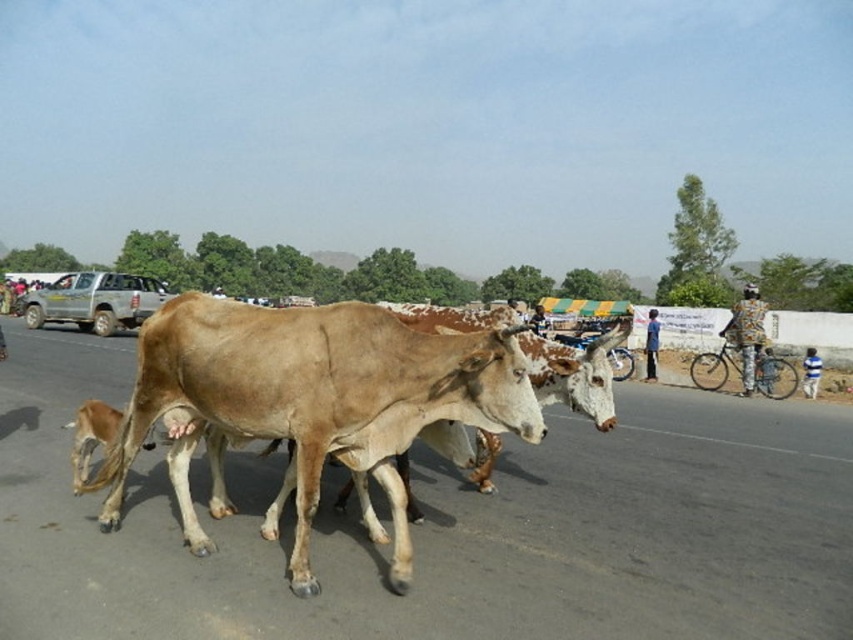
Does point (317, 438) come behind point (129, 301)?

No, (317, 438) is closer to viewer.

Is light brown smooth cow at center smaller than silver metallic pickup truck at center?

Yes.

Where is `light brown smooth cow at center`? This screenshot has width=853, height=640. light brown smooth cow at center is located at coordinates (312, 397).